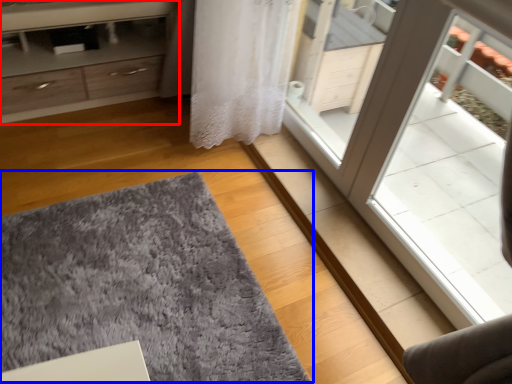
Question: Which object appears closest to the camera in this image, chest of drawers (highlighted by a red box) or doormat (highlighted by a blue box)?

Choices:
 (A) chest of drawers
 (B) doormat

Answer: (B)